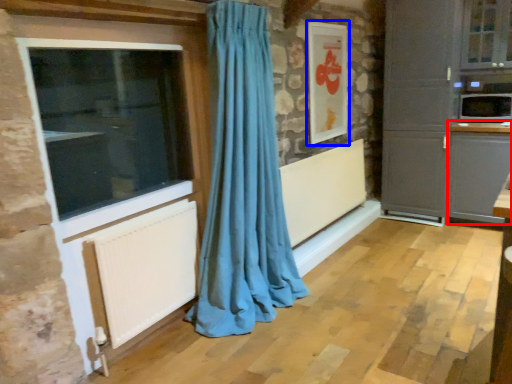
Question: Among these objects, which one is nearest to the camera, cabinetry (highlighted by a red box) or picture frame (highlighted by a blue box)?

Choices:
 (A) cabinetry
 (B) picture frame

Answer: (B)